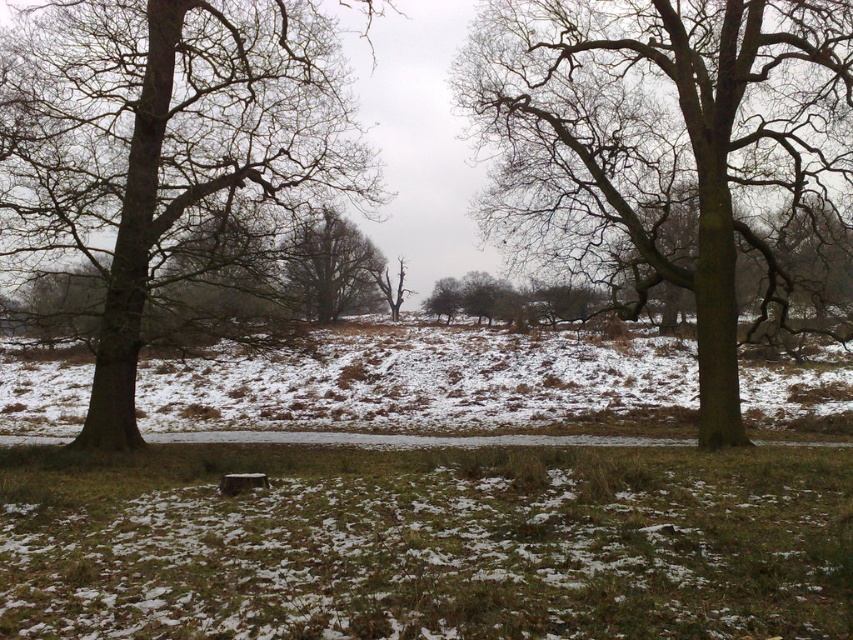
Question: Is green grass at center further to camera compared to brown rough bark tree at left?

Choices:
 (A) no
 (B) yes

Answer: (A)

Question: Is green rough bark tree at center above smooth bark tree at center?

Choices:
 (A) no
 (B) yes

Answer: (B)

Question: Estimate the real-world distances between objects in this image. Which object is farther from the brown rough bark tree at left?

Choices:
 (A) smooth bark tree at center
 (B) green rough bark tree at center

Answer: (B)

Question: Among these objects, which one is farthest from the camera?

Choices:
 (A) green rough bark tree at center
 (B) green grass at center
 (C) brown rough bark tree at left
 (D) smooth bark tree at center

Answer: (D)

Question: Observing the image, what is the correct spatial positioning of green grass at center in reference to brown rough bark tree at left?

Choices:
 (A) left
 (B) right

Answer: (B)

Question: Which point is farther to the camera?

Choices:
 (A) brown rough bark tree at left
 (B) green grass at center
 (C) smooth bark tree at center

Answer: (C)